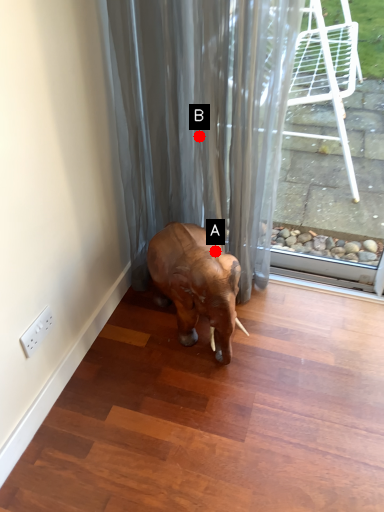
Question: Two points are circled on the image, labeled by A and B beside each circle. Which point is farther to the camera?

Choices:
 (A) A is further
 (B) B is further

Answer: (B)